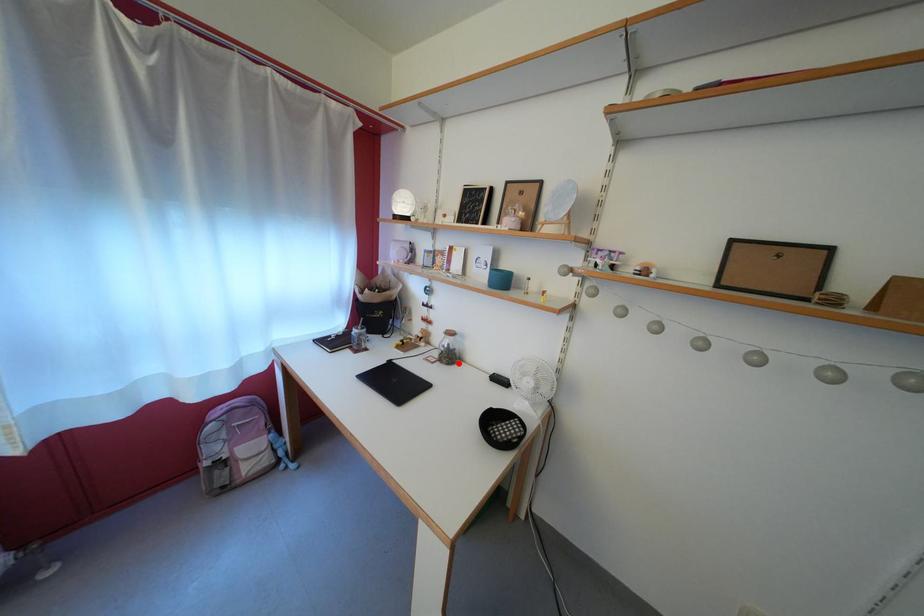
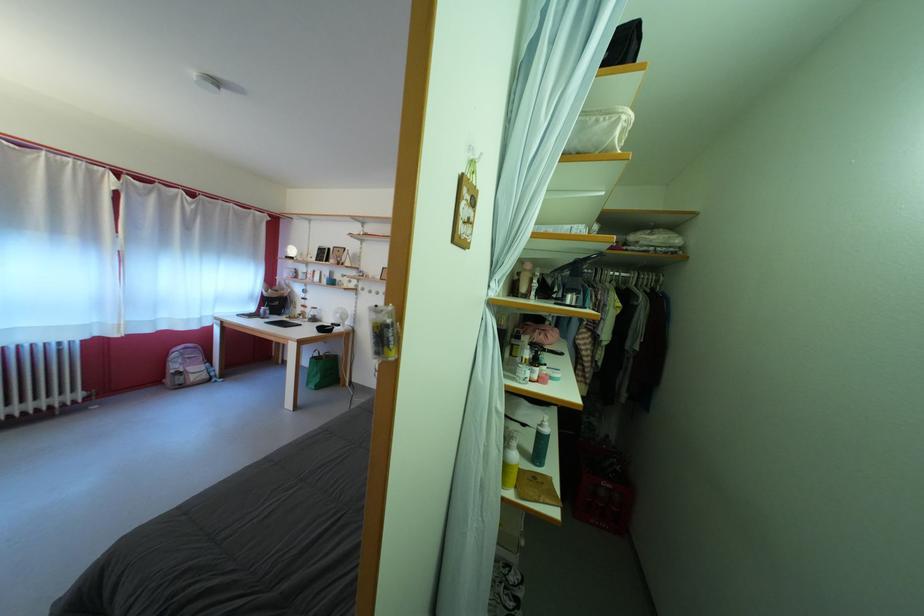
Find the pixel in the second image that matches the highlighted location in the first image.

(322, 325)